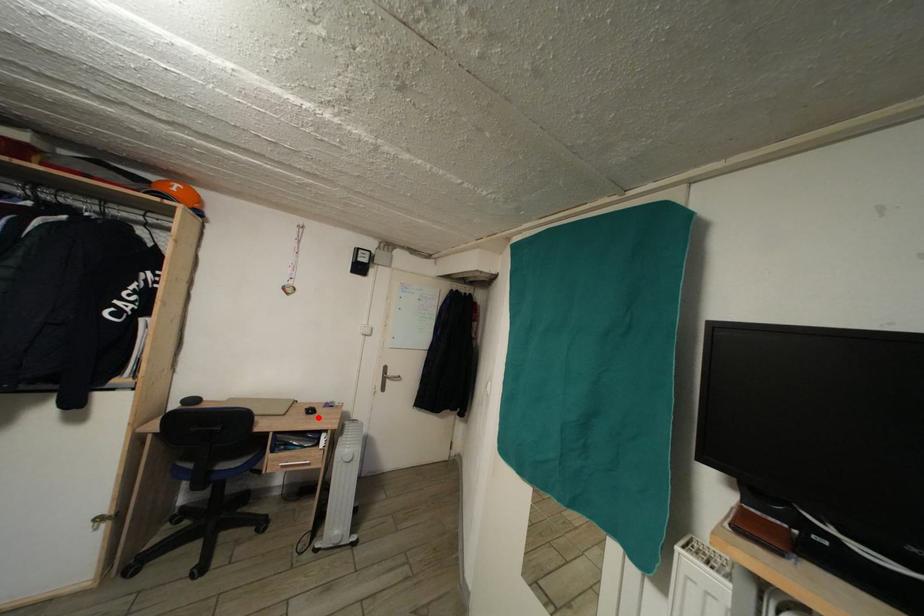
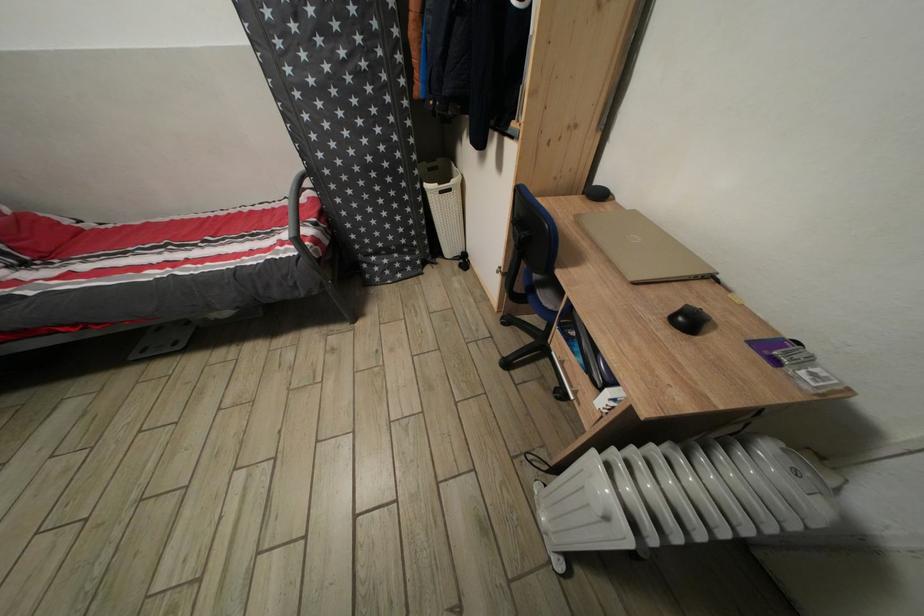
Find the pixel in the second image that matches the highlighted location in the first image.

(696, 328)